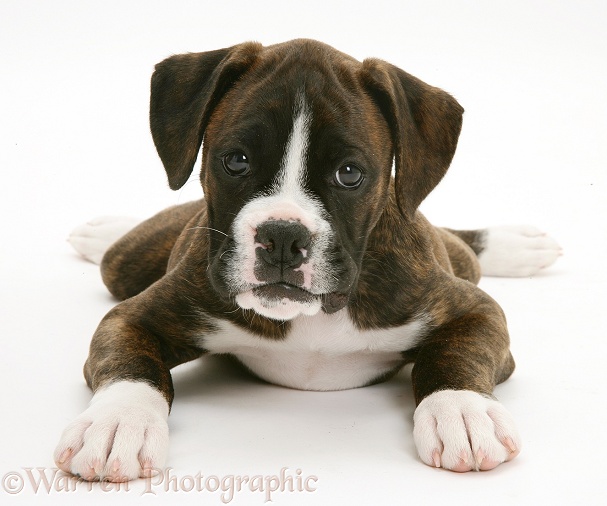
You are a GUI agent. You are given a task and a screenshot of the screen. Output one action in this format:
    pyautogui.click(x=<x>, y=<y>)
    Task: Click on the floor
    
    Given the screenshot: What is the action you would take?
    pyautogui.click(x=334, y=423)